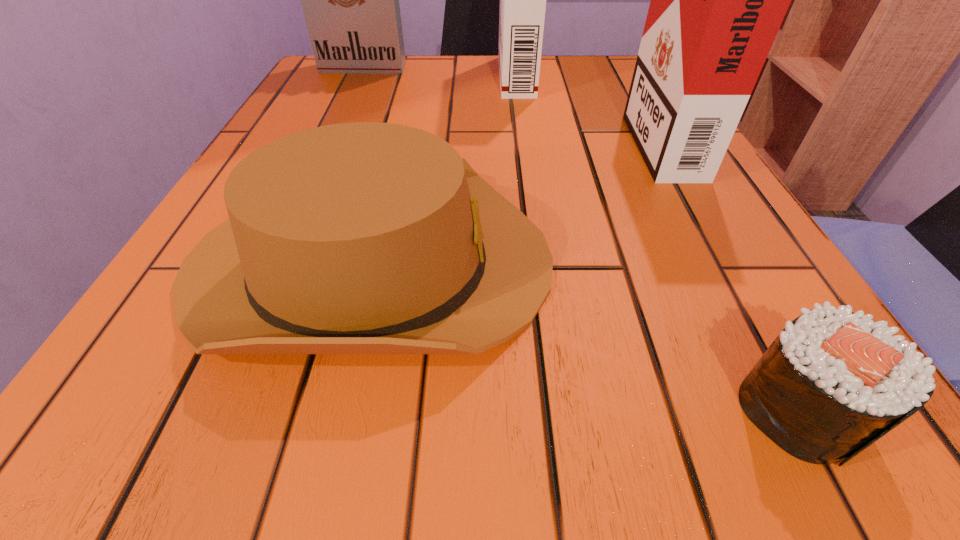
Find the location of `free space that is in between the sushi and the second shortest object`. free space that is in between the sushi and the second shortest object is located at coordinates (584, 335).

Identify the location of free space between the cowboy hat and the sushi. This screenshot has width=960, height=540. (584, 335).

Locate an element on the screen. The width and height of the screenshot is (960, 540). empty space between the nearest cigarette case and the leftmost cigarette case is located at coordinates (512, 103).

Locate an element on the screen. vacant point located between the nearest cigarette case and the second cigarette case from right to left is located at coordinates (588, 107).

The image size is (960, 540). What are the coordinates of `free space between the shortest object and the second cigarette case from left to right` in the screenshot? It's located at (658, 242).

The image size is (960, 540). I want to click on empty location between the leftmost cigarette case and the shortest object, so click(581, 238).

Locate an element on the screen. vacant point located between the cowboy hat and the rightmost cigarette case is located at coordinates (514, 200).

Identify which object is the second nearest to the nearest cigarette case. Please provide its 2D coordinates. Your answer should be formatted as a tuple, i.e. [(x, y)], where the tuple contains the x and y coordinates of a point satisfying the conditions above.

[(355, 238)]

Choose which object is the second nearest neighbor to the second cigarette case from left to right. Please provide its 2D coordinates. Your answer should be formatted as a tuple, i.e. [(x, y)], where the tuple contains the x and y coordinates of a point satisfying the conditions above.

[(350, 0)]

I want to click on the closest cigarette case to the nearest cigarette case, so click(x=522, y=0).